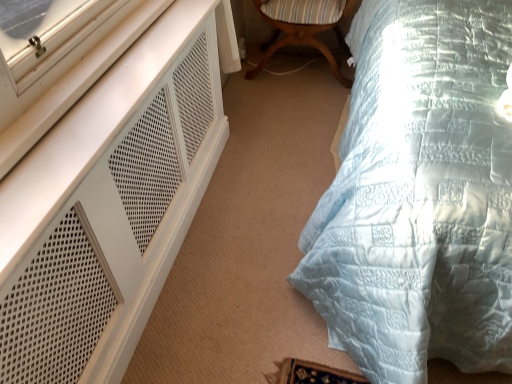
Identify the location of vacant space that's between wooden striped cushion at center and white mesh dresser at left. (251, 163).